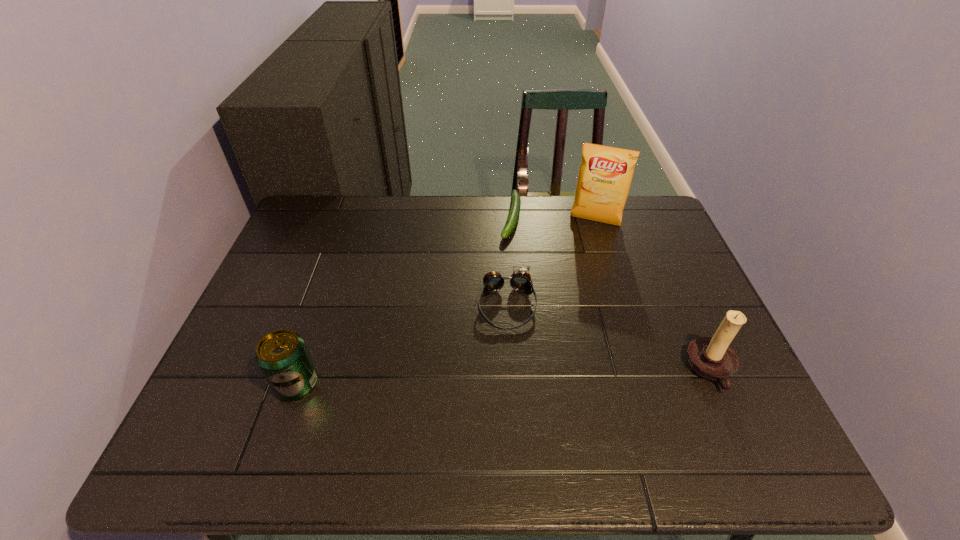
This screenshot has height=540, width=960. I want to click on free space located on the wick of the candle holder, so click(518, 370).

This screenshot has height=540, width=960. I want to click on vacant space located 0.140m on the wick of the candle holder, so click(x=626, y=370).

Where is `free spot located on the wick of the candle holder`? free spot located on the wick of the candle holder is located at coordinates (531, 370).

Where is `free space located 0.100m through the lenses of the fourth tallest object`? free space located 0.100m through the lenses of the fourth tallest object is located at coordinates (513, 367).

Identify the location of vacant area situated through the lenses of the fourth tallest object. (516, 410).

What are the coordinates of `vacant space positioned 0.120m through the lenses of the fourth tallest object` in the screenshot? It's located at 514,374.

The height and width of the screenshot is (540, 960). Find the location of `vacant area situated 0.370m on the front-facing side of the shortest object`. vacant area situated 0.370m on the front-facing side of the shortest object is located at coordinates (488, 336).

Image resolution: width=960 pixels, height=540 pixels. In order to click on vacant region located on the front-facing side of the shortest object in this screenshot , I will do `click(507, 255)`.

This screenshot has width=960, height=540. In order to click on vacant space located on the front-facing side of the shortest object in this screenshot , I will do `click(508, 253)`.

At what (x,y) coordinates should I click in order to perform the action: click on vacant area located on the front of the tallest object with the logo. Please return your answer as a coordinate pair (x, y). The image size is (960, 540). Looking at the image, I should click on (582, 253).